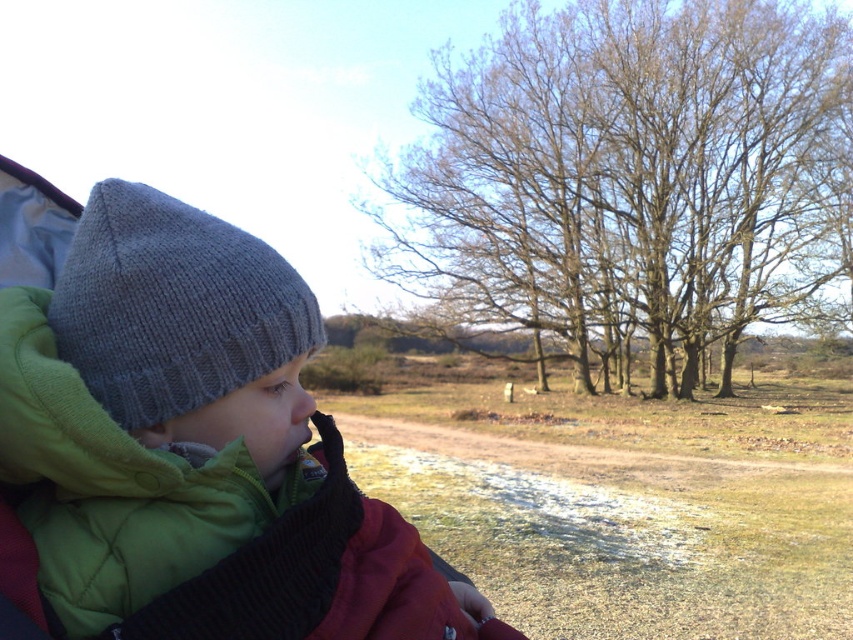
You are a photographer trying to capture the scene from the child perspective. The bare branches at upper center and the gray knitted hat at left are both in your viewfinder. Which object appears wider in the photo?

The bare branches at upper center appears wider in the photo because its width is larger than the gray knitted hat at left.

You are standing at the center of the dirt path and want to reach the knitted woolen hat at upper left and the bare branches at upper center. Which object is farther away from your current position?

The knitted woolen hat at upper left is 81.55 feet away from the bare branches at upper center. Since you are at the center of the dirt path, the knitted woolen hat at upper left is farther away than the bare branches at upper center.